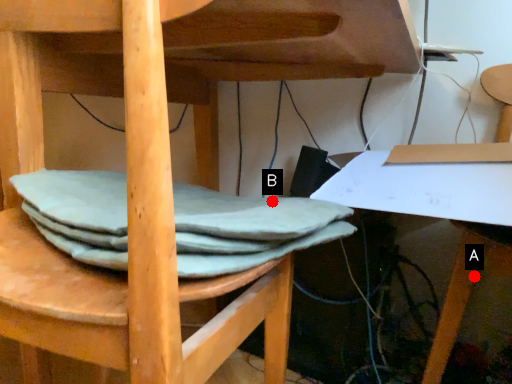
Question: Two points are circled on the image, labeled by A and B beside each circle. Which point is closer to the camera?

Choices:
 (A) A is closer
 (B) B is closer

Answer: (B)